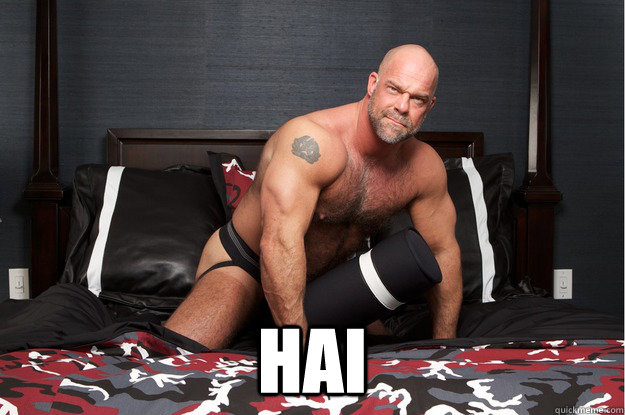
Where is `neck pillow`? The width and height of the screenshot is (625, 415). neck pillow is located at coordinates (370, 271).